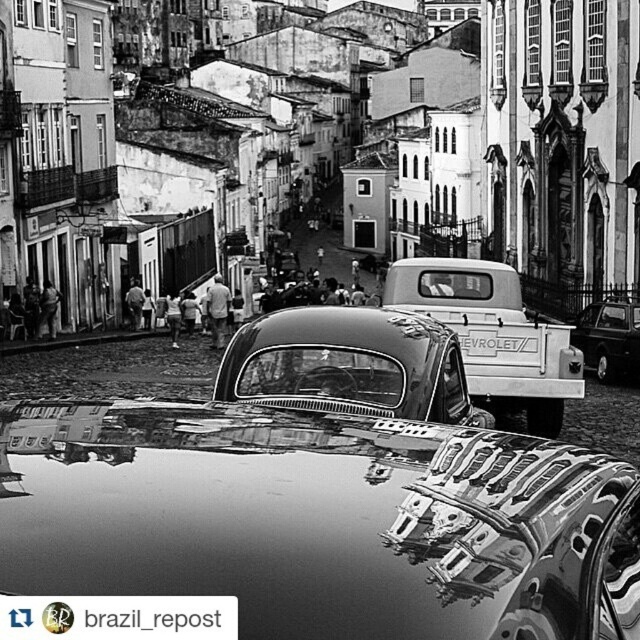
Question: Is white matte chevrolet truck at center below shiny chrome pickup truck at center?

Choices:
 (A) yes
 (B) no

Answer: (B)

Question: Based on their relative distances, which object is nearer to the shiny chrome pickup truck at center?

Choices:
 (A) white matte chevrolet truck at center
 (B) shiny black car at center

Answer: (A)

Question: Among these points, which one is nearest to the camera?

Choices:
 (A) (557, 349)
 (B) (628, 589)
 (C) (589, 323)

Answer: (B)

Question: Which object is the closest to the shiny black car at center?

Choices:
 (A) white matte chevrolet truck at center
 (B) shiny chrome pickup truck at center

Answer: (A)

Question: Is white matte chevrolet truck at center to the right of shiny chrome pickup truck at center from the viewer's perspective?

Choices:
 (A) yes
 (B) no

Answer: (B)

Question: Does shiny black car at center appear over white matte chevrolet truck at center?

Choices:
 (A) no
 (B) yes

Answer: (A)